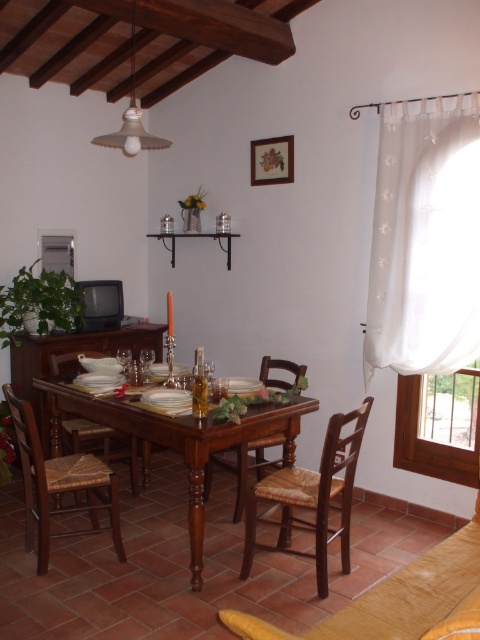
You are a guest entering the dining room and want to sit down at the table. Which object, the mahogany wood table at center or the woven brown chair at center, should you approach first to reach your seat?

You should approach the woven brown chair at center first because the mahogany wood table at center is positioned over it, meaning the chair is underneath the table and closer to you.

You are a server carrying a tray of dishes and need to navigate between the mahogany wood table at center and the brown woven chair at center. The tray is 40 centimeters wide. Can you safely pass through the space between them without tilting the tray?

The distance between the mahogany wood table at center and the brown woven chair at center is 41.95 centimeters. Since the tray is 40 centimeters wide, there is enough space to pass safely without tilting the tray.

You are standing in the dining room and want to move from the dining table to the entrance door. The dining table is located at point A and the entrance door is at point B. If point A corresponds to point (389, 104) and point B corresponds to point (132, 403), which direction should you walk to reach the door?

Since point A is further to the viewer than point B, you should walk towards the direction of point B, which is closer to the entrance door.